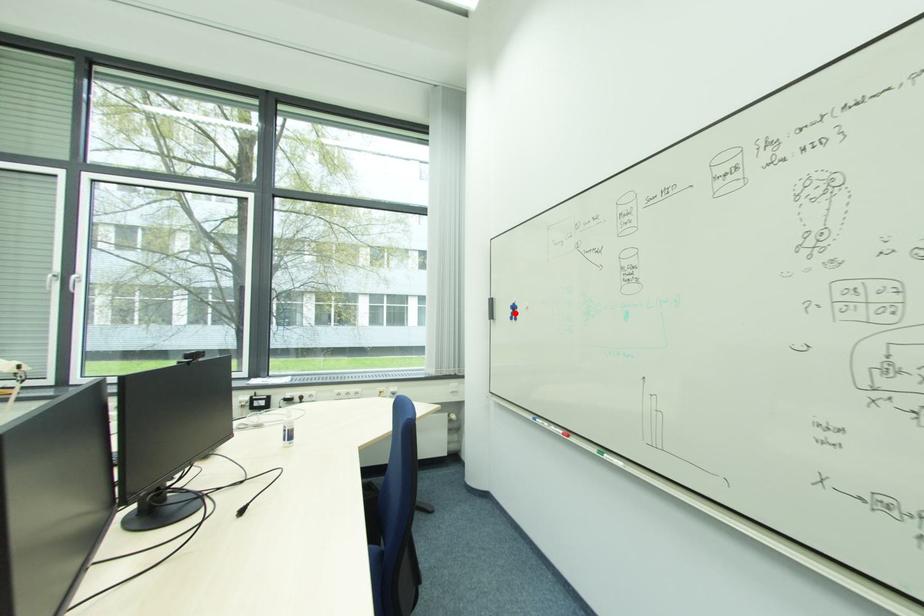
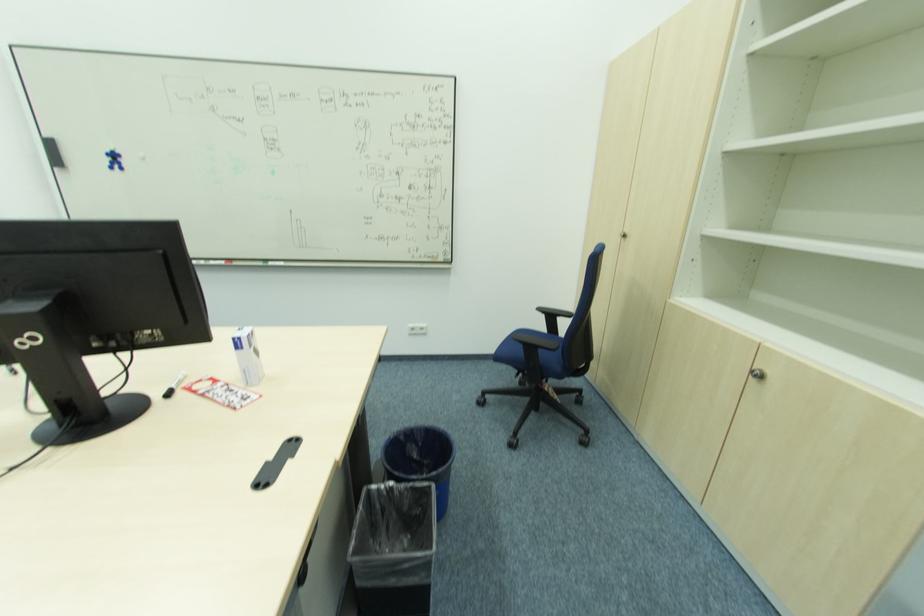
The point at the highlighted location is marked in the first image. Where is the corresponding point in the second image?

(116, 161)